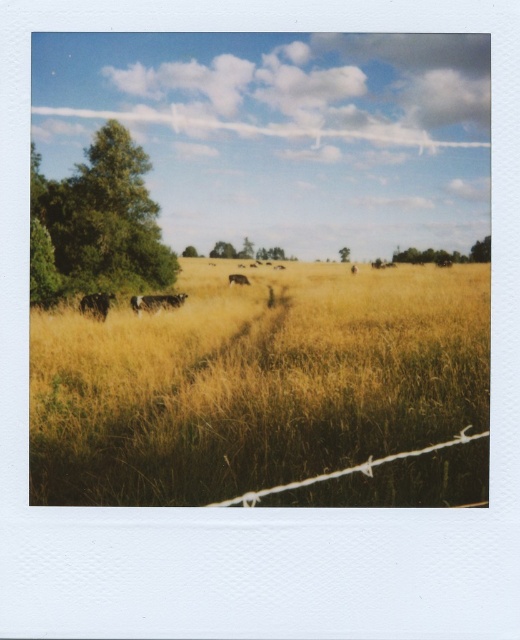
Is yellow grassy field at lower left positioned before green leafy tree at left?

Yes.

This screenshot has width=520, height=640. I want to click on yellow grassy field at lower left, so click(267, 390).

Does yellow grassy field at lower left appear on the left side of green leafy tree at upper right?

Indeed, yellow grassy field at lower left is positioned on the left side of green leafy tree at upper right.

How distant is yellow grassy field at lower left from green leafy tree at upper right?

They are 55.90 meters apart.

What do you see at coordinates (267, 390) in the screenshot? This screenshot has width=520, height=640. I see `yellow grassy field at lower left` at bounding box center [267, 390].

The image size is (520, 640). Find the location of `yellow grassy field at lower left`. yellow grassy field at lower left is located at coordinates (267, 390).

Does brown furry cow at lower left appear over green leafy tree at upper left?

No, brown furry cow at lower left is not above green leafy tree at upper left.

Between point (151, 298) and point (184, 253), which one is positioned behind?

The point (184, 253) is behind.

This screenshot has height=640, width=520. Find the location of `brown furry cow at lower left`. brown furry cow at lower left is located at coordinates (157, 301).

Where is `brown furry cow at lower left`? brown furry cow at lower left is located at coordinates (157, 301).